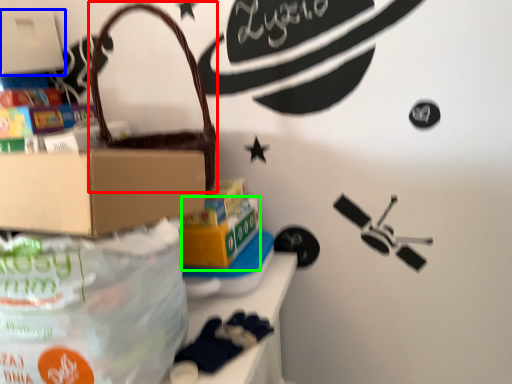
Question: Considering the real-world distances, which object is farthest from handbag (highlighted by a red box)? box (highlighted by a blue box) or box (highlighted by a green box)?

Choices:
 (A) box
 (B) box

Answer: (A)